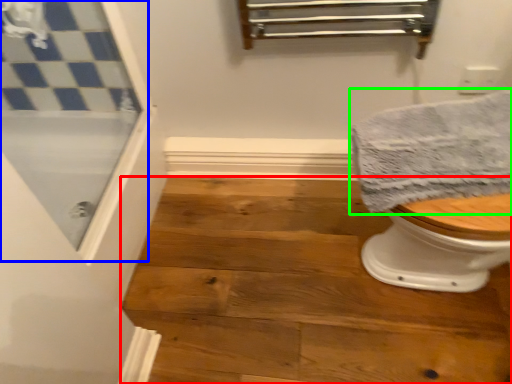
Question: Based on their relative distances, which object is farther from stair (highlighted by a red box)? Choose from screen door (highlighted by a blue box) and towel (highlighted by a green box).

Choices:
 (A) screen door
 (B) towel

Answer: (A)